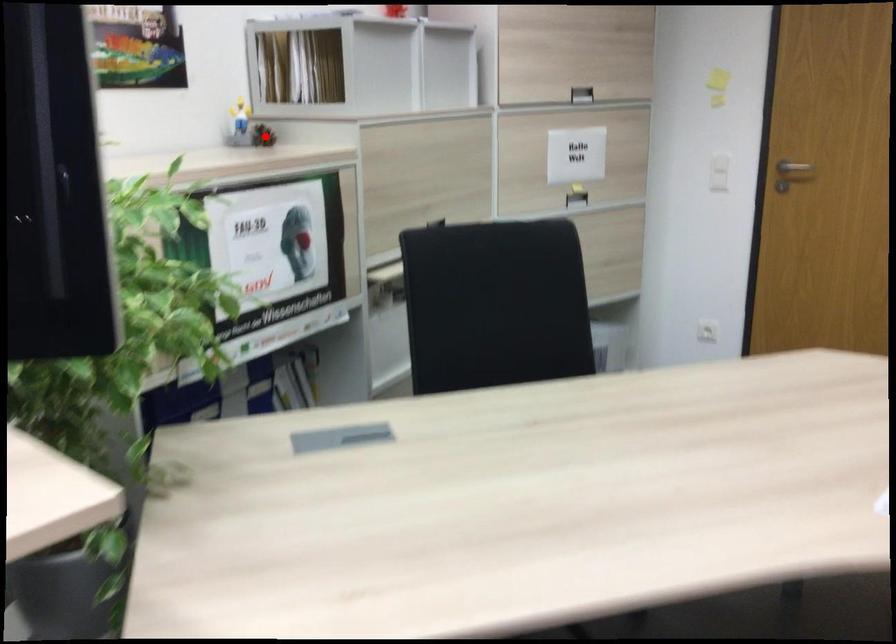
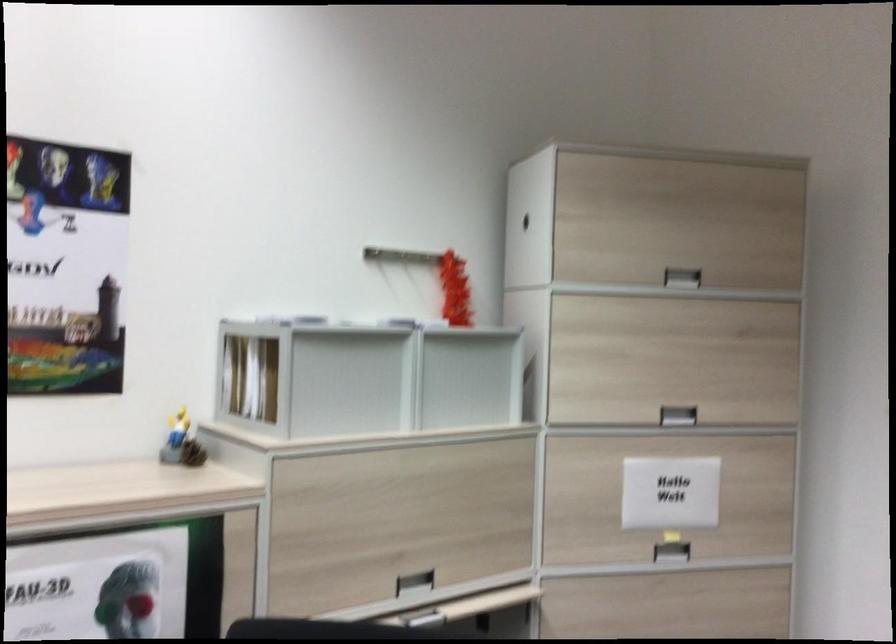
Locate, in the second image, the point that corresponds to the highlighted location in the first image.

(192, 453)